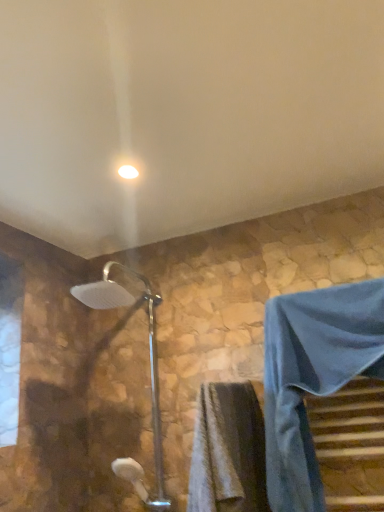
Question: Is gray textured towel at lower center at the back of silver metallic shower head at center?

Choices:
 (A) yes
 (B) no

Answer: (B)

Question: Is silver metallic shower head at center thinner than gray textured towel at lower center?

Choices:
 (A) no
 (B) yes

Answer: (A)

Question: Can you confirm if silver metallic shower head at center is positioned to the left of gray textured towel at lower center?

Choices:
 (A) no
 (B) yes

Answer: (B)

Question: Is silver metallic shower head at center behind gray textured towel at lower center?

Choices:
 (A) yes
 (B) no

Answer: (A)

Question: Considering the relative positions of silver metallic shower head at center and gray textured towel at lower center in the image provided, is silver metallic shower head at center in front of gray textured towel at lower center?

Choices:
 (A) no
 (B) yes

Answer: (A)

Question: In terms of height, does white glossy light fixture at upper center look taller or shorter compared to gray textured towel at lower center?

Choices:
 (A) tall
 (B) short

Answer: (B)

Question: From a real-world perspective, is white glossy light fixture at upper center above or below gray textured towel at lower center?

Choices:
 (A) above
 (B) below

Answer: (A)

Question: Is white glossy light fixture at upper center inside the boundaries of gray textured towel at lower center, or outside?

Choices:
 (A) inside
 (B) outside

Answer: (B)

Question: Is white glossy light fixture at upper center to the left or to the right of gray textured towel at lower center in the image?

Choices:
 (A) right
 (B) left

Answer: (B)

Question: Considering the positions of white glossy light fixture at upper center and blue fabric robe at lower right in the image, is white glossy light fixture at upper center bigger or smaller than blue fabric robe at lower right?

Choices:
 (A) big
 (B) small

Answer: (B)

Question: From a real-world perspective, relative to blue fabric robe at lower right, is white glossy light fixture at upper center vertically above or below?

Choices:
 (A) above
 (B) below

Answer: (A)

Question: Considering the relative positions of white glossy light fixture at upper center and blue fabric robe at lower right in the image provided, is white glossy light fixture at upper center to the left or to the right of blue fabric robe at lower right?

Choices:
 (A) right
 (B) left

Answer: (B)

Question: Is white glossy light fixture at upper center inside or outside of blue fabric robe at lower right?

Choices:
 (A) inside
 (B) outside

Answer: (B)

Question: In terms of height, does silver metallic shower head at center look taller or shorter compared to white glossy light fixture at upper center?

Choices:
 (A) short
 (B) tall

Answer: (B)

Question: Does point (155, 389) appear closer or farther from the camera than point (135, 169)?

Choices:
 (A) farther
 (B) closer

Answer: (A)